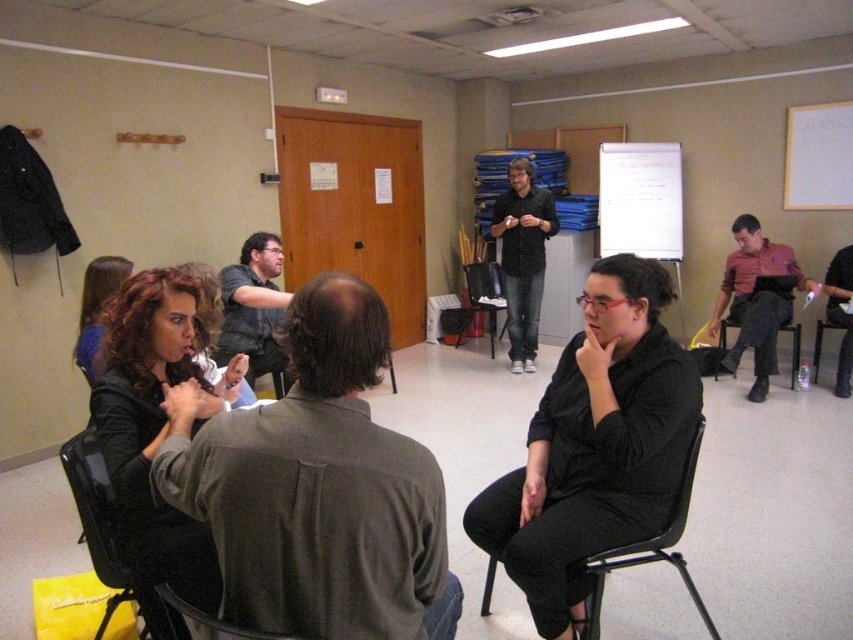
Between point (664, 209) and point (730, 324), which one is positioned in front?

Point (730, 324) is more forward.

Is white paper at upper center above black plastic chair at right?

Yes, white paper at upper center is above black plastic chair at right.

The image size is (853, 640). Describe the element at coordinates (640, 198) in the screenshot. I see `white paper at upper center` at that location.

At what (x,y) coordinates should I click in order to perform the action: click on white paper at upper center. Please return your answer as a coordinate pair (x, y). The image size is (853, 640). Looking at the image, I should click on (640, 198).

Who is lower down, black matte shirt at center or matte black hair at lower left?

Positioned lower is black matte shirt at center.

Does point (524, 502) come closer to viewer compared to point (105, 292)?

Yes, point (524, 502) is closer to viewer.

Which is behind, point (575, 451) or point (90, 371)?

The point (90, 371) is behind.

In order to click on black matte shirt at center in this screenshot , I will do `click(595, 445)`.

Locate an element on the screen. dark brown shirt at center is located at coordinates (318, 488).

Between dark brown shirt at center and matte black shirt at center, which one is positioned higher?

matte black shirt at center

Image resolution: width=853 pixels, height=640 pixels. What do you see at coordinates (318, 488) in the screenshot?
I see `dark brown shirt at center` at bounding box center [318, 488].

This screenshot has height=640, width=853. I want to click on dark brown shirt at center, so click(318, 488).